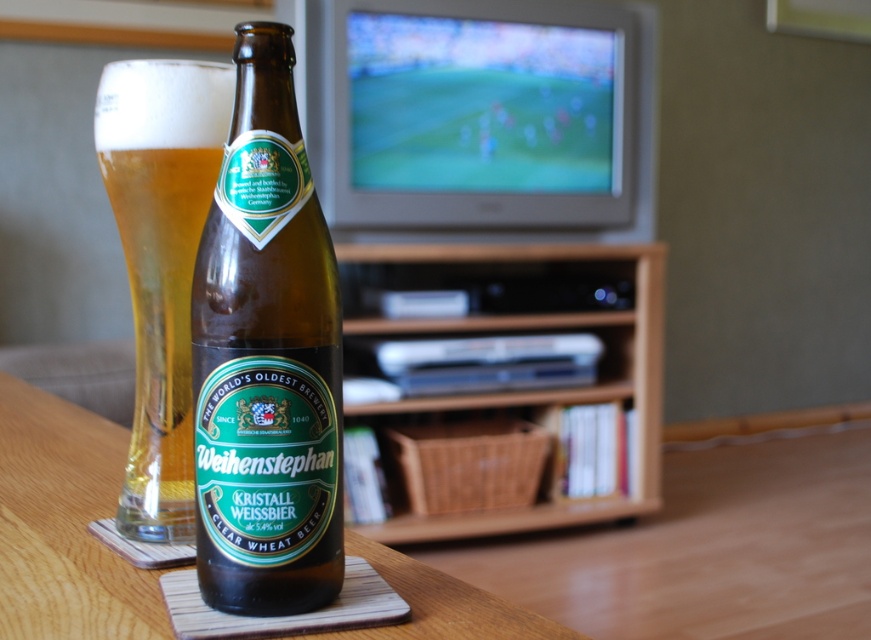
Looking at this image, can you confirm if brown glass beer bottle at center is thinner than clear glass beer at center?

Yes, brown glass beer bottle at center is thinner than clear glass beer at center.

Is the position of brown glass beer bottle at center more distant than that of clear glass beer at center?

No, it is in front of clear glass beer at center.

Describe the element at coordinates (267, 356) in the screenshot. I see `brown glass beer bottle at center` at that location.

Identify the location of brown glass beer bottle at center. The image size is (871, 640). (267, 356).

Who is taller, brown glass beer bottle at center or wooden coaster at center?

With more height is brown glass beer bottle at center.

In order to click on brown glass beer bottle at center in this screenshot , I will do `click(267, 356)`.

The image size is (871, 640). Identify the location of brown glass beer bottle at center. (267, 356).

Is brown glass beer bottle at center bigger than wooden entertainment center at center?

Incorrect, brown glass beer bottle at center is not larger than wooden entertainment center at center.

Consider the image. Measure the distance between point (327, 344) and camera.

15.74 inches

At what (x,y) coordinates should I click in order to perform the action: click on brown glass beer bottle at center. Please return your answer as a coordinate pair (x, y). The height and width of the screenshot is (640, 871). Looking at the image, I should click on (267, 356).